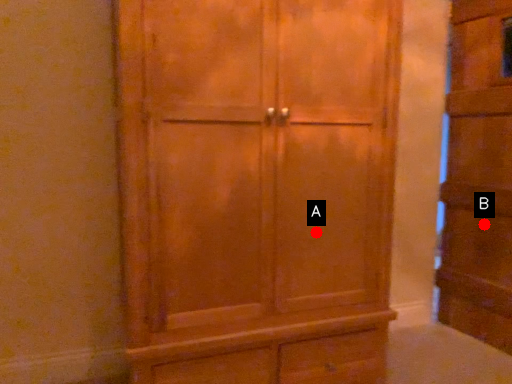
Question: Two points are circled on the image, labeled by A and B beside each circle. Which point appears closest to the camera in this image?

Choices:
 (A) A is closer
 (B) B is closer

Answer: (A)